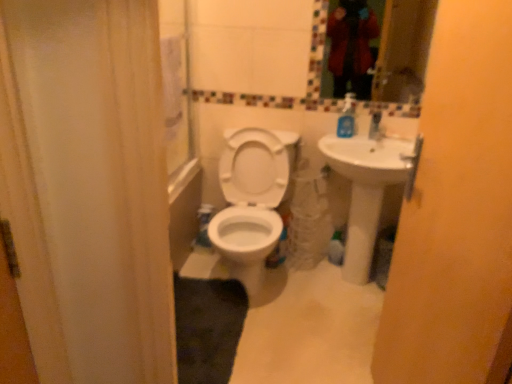
Question: Considering the relative positions of matte yellow screen door at right and blue plastic soap dispenser at upper right in the image provided, is matte yellow screen door at right to the left or to the right of blue plastic soap dispenser at upper right?

Choices:
 (A) right
 (B) left

Answer: (B)

Question: From their relative heights in the image, would you say matte yellow screen door at right is taller or shorter than blue plastic soap dispenser at upper right?

Choices:
 (A) short
 (B) tall

Answer: (B)

Question: Considering the real-world distances, which object is farthest from the glassy mosaic mirror at upper center?

Choices:
 (A) blue plastic soap dispenser at upper right
 (B) white glossy sink at right
 (C) white glossy toilet at center
 (D) matte yellow screen door at right

Answer: (D)

Question: Which object is the farthest from the white glossy toilet at center?

Choices:
 (A) blue plastic soap dispenser at upper right
 (B) white glossy sink at right
 (C) glassy mosaic mirror at upper center
 (D) matte yellow screen door at right

Answer: (C)